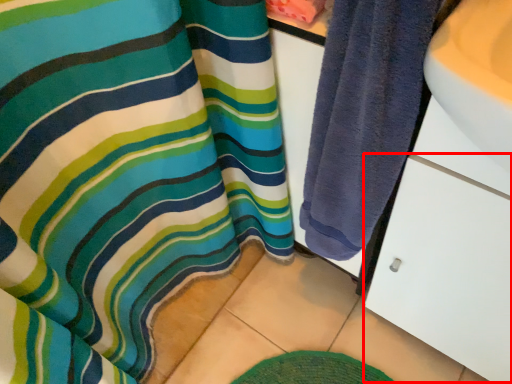
Question: From the image, what is the correct spatial relationship of drawer (annotated by the red box) in relation to towel?

Choices:
 (A) left
 (B) right

Answer: (B)